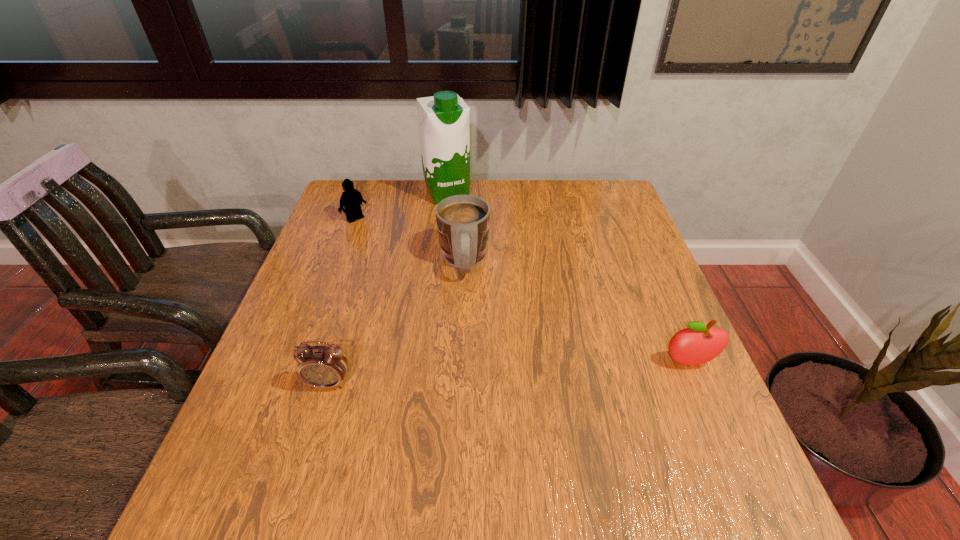
Locate an element on the screen. the nearest object is located at coordinates (325, 367).

This screenshot has width=960, height=540. In order to click on the rightmost object in this screenshot , I will do `click(700, 343)`.

Locate an element on the screen. The image size is (960, 540). the second nearest object is located at coordinates (700, 343).

Locate an element on the screen. mug is located at coordinates (463, 221).

Identify the location of the second farthest object. The width and height of the screenshot is (960, 540). pos(351,199).

At what (x,y) coordinates should I click in order to perform the action: click on the farthest object. Please return your answer as a coordinate pair (x, y). The height and width of the screenshot is (540, 960). Looking at the image, I should click on (444, 119).

Locate an element on the screen. Image resolution: width=960 pixels, height=540 pixels. the tallest object is located at coordinates (x=444, y=119).

Find the location of a particular element. The width and height of the screenshot is (960, 540). free space located on the face of the nearest object is located at coordinates (318, 419).

Locate an element on the screen. The image size is (960, 540). vacant area situated 0.090m on the front-facing side of the apple is located at coordinates (709, 410).

This screenshot has width=960, height=540. Find the location of `vacant space located on the side of the mug with the handle`. vacant space located on the side of the mug with the handle is located at coordinates (474, 401).